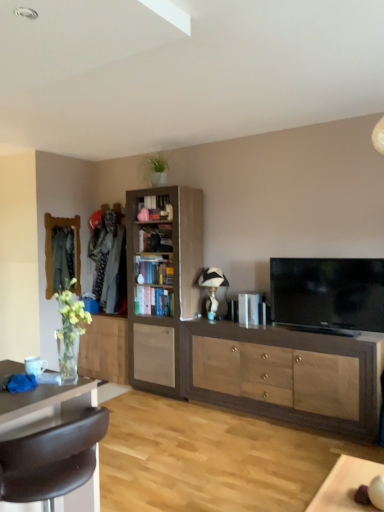
Question: Is matte wood cabinet at center, positioned as the 1th cabinetry in right-to-left order, taller or shorter than brown leather chair at lower left?

Choices:
 (A) short
 (B) tall

Answer: (A)

Question: Looking at their shapes, would you say matte wood cabinet at center, which appears as the 3th cabinetry when viewed from the left, is wider or thinner than brown leather chair at lower left?

Choices:
 (A) wide
 (B) thin

Answer: (B)

Question: Estimate the real-world distances between objects in this image. Which object is closer to the brown leather chair at lower left?

Choices:
 (A) matte wooden mirror at left
 (B) light brown wood bookshelf at center, placed as the 2th cabinetry when sorted from right to left
 (C) wooden bookshelf at center, which is the 1th shelf from bottom to top
 (D) matte wood cabinet at center, positioned as the 1th cabinetry in right-to-left order
 (E) flat screen tv at right

Answer: (D)

Question: Which is nearer to the wooden bookshelf at center, which is the 1th shelf from bottom to top?

Choices:
 (A) matte wood cabinet at center, positioned as the 1th cabinetry in right-to-left order
 (B) brown leather chair at lower left
 (C) matte wooden mirror at left
 (D) light brown wood cabinet at center, marked as the third cabinetry in a right-to-left arrangement
 (E) wooden bookshelf at center, which ranks as the second shelf in bottom-to-top order

Answer: (E)